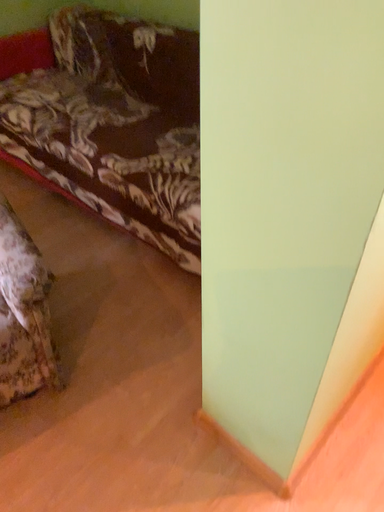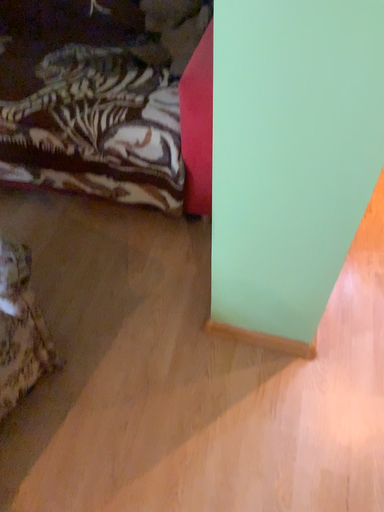
Question: Which way did the camera rotate in the video?

Choices:
 (A) rotated left
 (B) rotated right

Answer: (B)